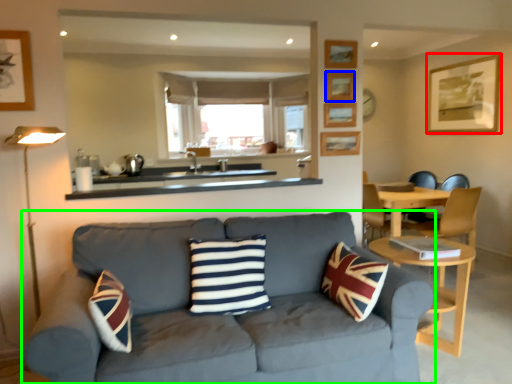
Question: Based on their relative distances, which object is farther from picture frame (highlighted by a red box)? Choose from picture frame (highlighted by a blue box) and studio couch (highlighted by a green box).

Choices:
 (A) picture frame
 (B) studio couch

Answer: (B)